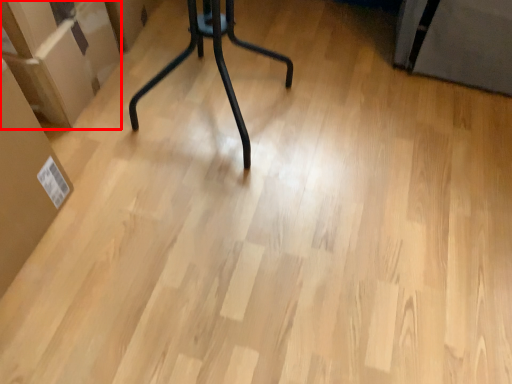
Question: From the image's perspective, what is the correct spatial relationship of cardboard box (annotated by the red box) in relation to cardboard box?

Choices:
 (A) above
 (B) below

Answer: (A)